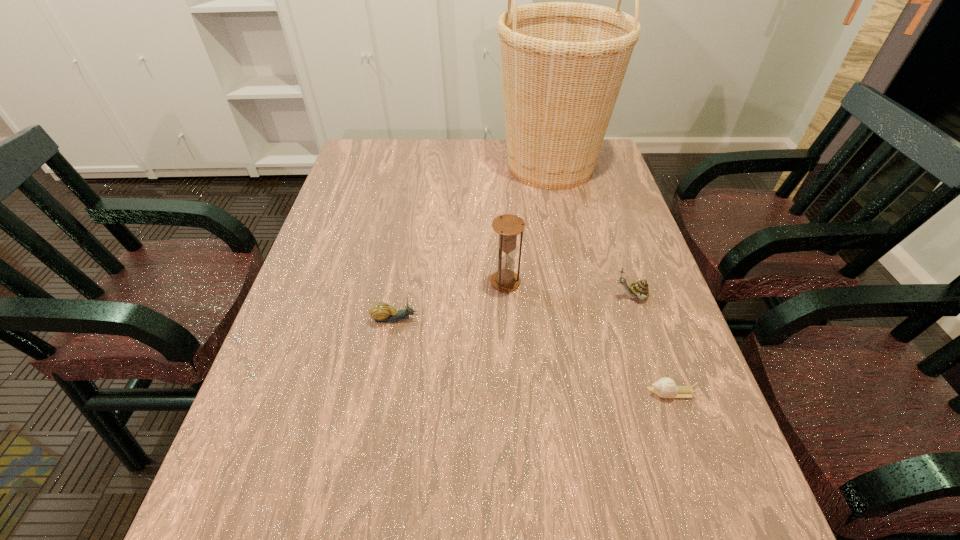
The width and height of the screenshot is (960, 540). In order to click on object positioned at the far right corner in this screenshot , I will do `click(563, 63)`.

At what (x,y) coordinates should I click in order to perform the action: click on free region at the far edge of the desktop. Please return your answer as a coordinate pair (x, y). This screenshot has width=960, height=540. Looking at the image, I should click on (420, 157).

Identify the location of free space at the left edge of the desktop. This screenshot has width=960, height=540. (342, 334).

You are a GUI agent. You are given a task and a screenshot of the screen. Output one action in this format:
    pyautogui.click(x=<x>, y=<y>)
    Task: Click on the vacant space at the right edge
    The height and width of the screenshot is (540, 960).
    Given the screenshot: What is the action you would take?
    (x=630, y=222)

Locate an element on the screen. The height and width of the screenshot is (540, 960). vacant space at the far left corner of the desktop is located at coordinates (376, 152).

Identify the location of vacant point located between the shortest escargot and the tallest object. (611, 280).

Where is `vacant area between the shortest object and the tallest escargot`? The image size is (960, 540). vacant area between the shortest object and the tallest escargot is located at coordinates (651, 345).

Where is `vacant space that's between the fourth shortest object and the shortest escargot`? This screenshot has height=540, width=960. vacant space that's between the fourth shortest object and the shortest escargot is located at coordinates (588, 338).

Identify the location of free space between the shortest escargot and the basket. (611, 280).

The image size is (960, 540). I want to click on vacant area that lies between the nearest escargot and the tallest object, so click(611, 280).